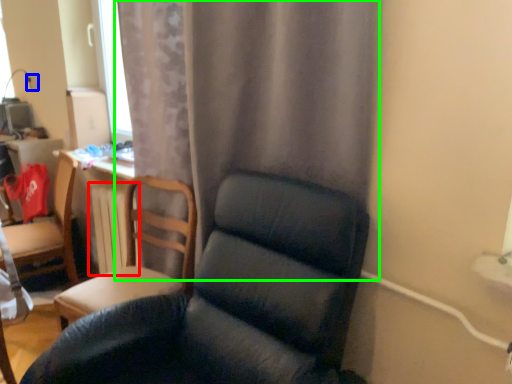
Question: Considering the real-world distances, which object is farthest from radiator (highlighted by a red box)? electric outlet (highlighted by a blue box) or curtain (highlighted by a green box)?

Choices:
 (A) electric outlet
 (B) curtain

Answer: (A)